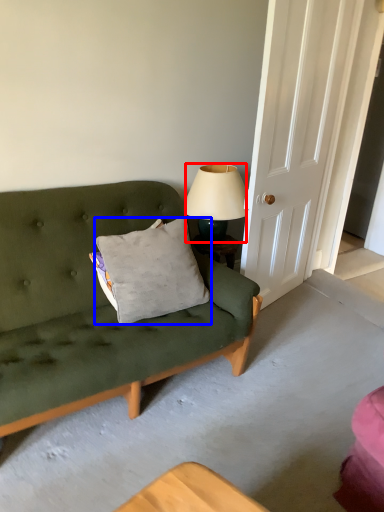
Question: Among these objects, which one is nearest to the camera, lamp (highlighted by a red box) or pillow (highlighted by a blue box)?

Choices:
 (A) lamp
 (B) pillow

Answer: (B)